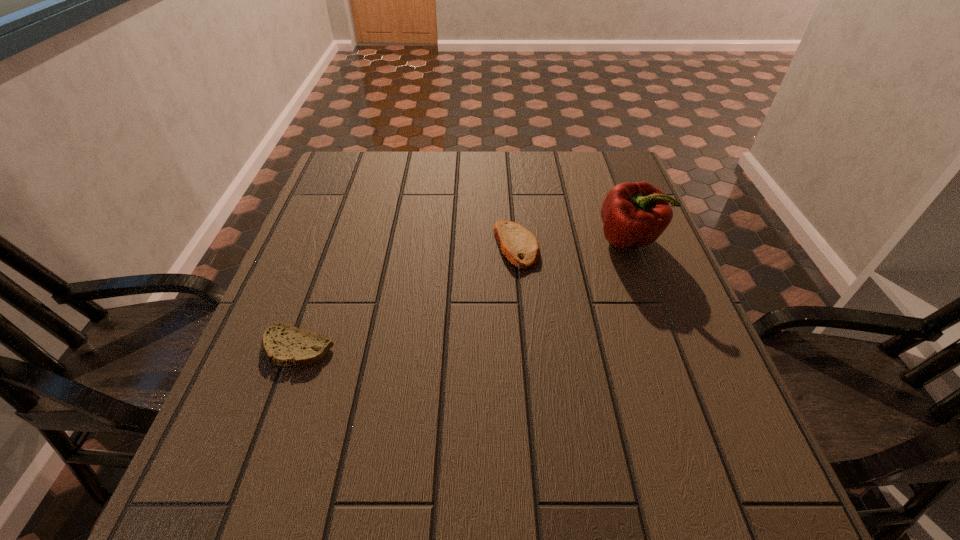
In order to click on vacant space that is in between the tallest object and the right pita bread in this screenshot , I will do `click(572, 242)`.

Locate an element on the screen. empty location between the shortest object and the rightmost object is located at coordinates (464, 294).

The width and height of the screenshot is (960, 540). Find the location of `empty location between the tallest object and the right pita bread`. empty location between the tallest object and the right pita bread is located at coordinates (572, 242).

Find the location of a particular element. The image size is (960, 540). vacant space in between the second object from right to left and the rightmost object is located at coordinates (572, 242).

The width and height of the screenshot is (960, 540). I want to click on free space between the rightmost object and the farther pita bread, so click(572, 242).

Locate which object ranks second in proximity to the rightmost object. Please provide its 2D coordinates. Your answer should be formatted as a tuple, i.e. [(x, y)], where the tuple contains the x and y coordinates of a point satisfying the conditions above.

[(284, 345)]

The image size is (960, 540). What are the coordinates of `the closest object relative to the bell pepper` in the screenshot? It's located at (520, 246).

Identify the location of free space in the image that satisfies the following two spatial constraints: 1. on the back side of the farther pita bread; 2. on the left side of the rightmost object. This screenshot has width=960, height=540. (516, 240).